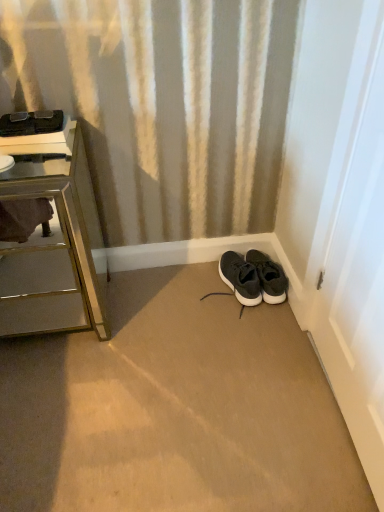
The height and width of the screenshot is (512, 384). In order to click on vacant space that is in between metallic mirrored chest of drawers at left and matte black sneaker at lower right in this screenshot , I will do `click(161, 302)`.